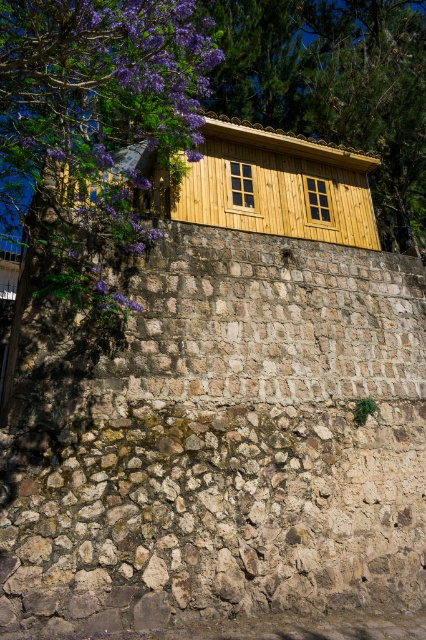
Describe the element at coordinates (239, 184) in the screenshot. I see `wooden window at upper center` at that location.

Looking at this image, between wooden window at upper center and wooden window at center, which one has less height?

wooden window at center is shorter.

Locate an element on the screen. Image resolution: width=426 pixels, height=640 pixels. wooden window at upper center is located at coordinates (239, 184).

Which of these two, brown stone wall at upper center or wooden window at center, stands taller?

wooden window at center is taller.

Is point (351, 328) less distant than point (302, 177)?

Yes, point (351, 328) is in front of point (302, 177).

This screenshot has height=640, width=426. Describe the element at coordinates (224, 442) in the screenshot. I see `brown stone wall at upper center` at that location.

Where is `brown stone wall at upper center`? This screenshot has height=640, width=426. brown stone wall at upper center is located at coordinates (224, 442).

Who is lower down, brown stone wall at upper center or wooden window at upper center?

Positioned lower is brown stone wall at upper center.

Does brown stone wall at upper center appear on the right side of wooden window at upper center?

In fact, brown stone wall at upper center is to the left of wooden window at upper center.

The height and width of the screenshot is (640, 426). In order to click on brown stone wall at upper center in this screenshot , I will do `click(224, 442)`.

The height and width of the screenshot is (640, 426). In order to click on brown stone wall at upper center in this screenshot , I will do `click(224, 442)`.